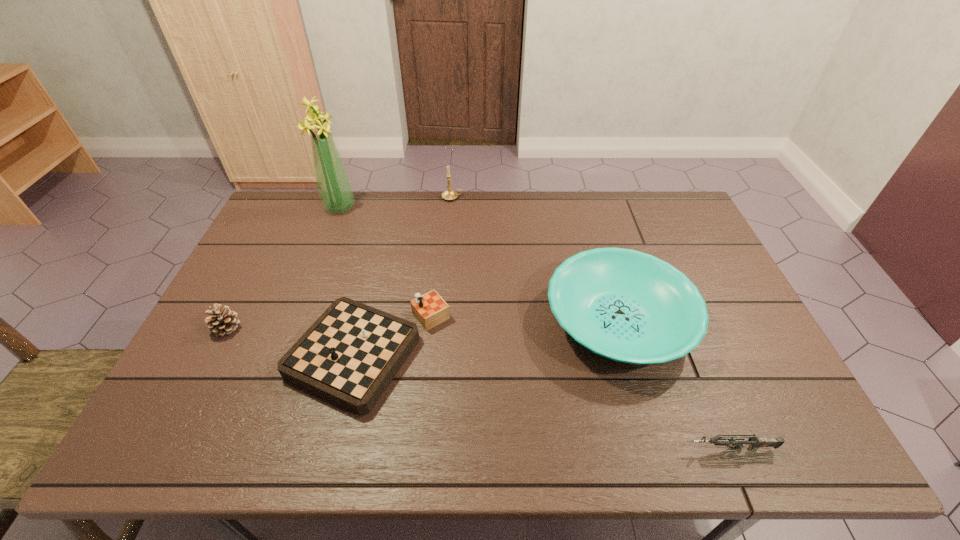
Where is `gun situated at the right edge`? gun situated at the right edge is located at coordinates (755, 442).

Identify the location of object that is at the near right corner. The height and width of the screenshot is (540, 960). (755, 442).

In the image, there is a desktop. In order to click on vacant space at the far edge in this screenshot , I will do `click(589, 215)`.

Find the location of a particular element. Image resolution: width=960 pixels, height=540 pixels. vacant space at the near edge of the desktop is located at coordinates (415, 437).

The height and width of the screenshot is (540, 960). In the image, there is a desktop. What are the coordinates of `free space at the left edge` in the screenshot? It's located at (211, 365).

In the image, there is a desktop. Where is `vacant space at the far left corner`? This screenshot has height=540, width=960. vacant space at the far left corner is located at coordinates (290, 206).

This screenshot has height=540, width=960. I want to click on vacant area at the far right corner, so point(678,195).

This screenshot has width=960, height=540. What are the coordinates of `free space between the chessboard and the nearest object` in the screenshot? It's located at (549, 401).

Find the location of a particular element. The width and height of the screenshot is (960, 540). empty space that is in between the bouquet and the dish is located at coordinates (479, 264).

Find the location of a particular element. The height and width of the screenshot is (540, 960). empty location between the tallest object and the candle holder is located at coordinates (396, 202).